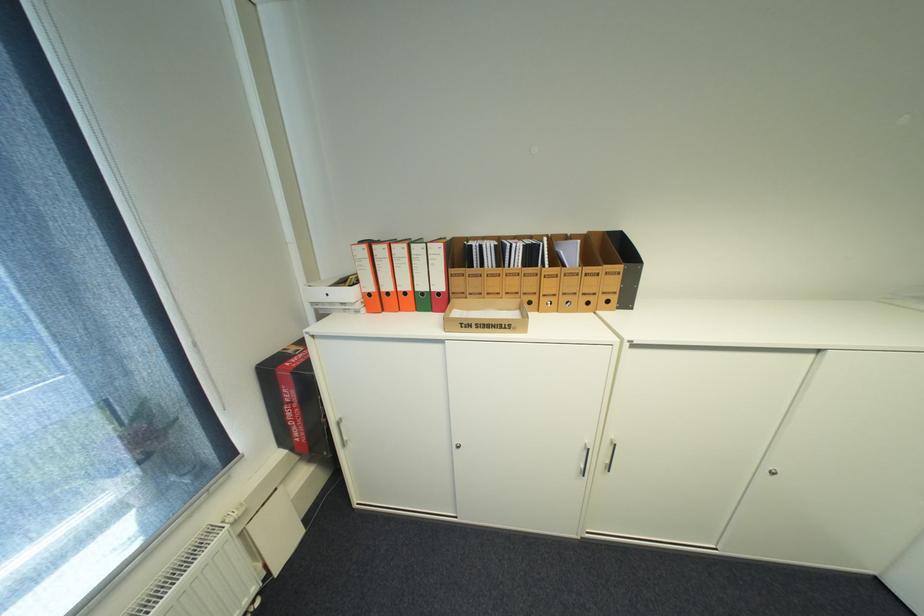
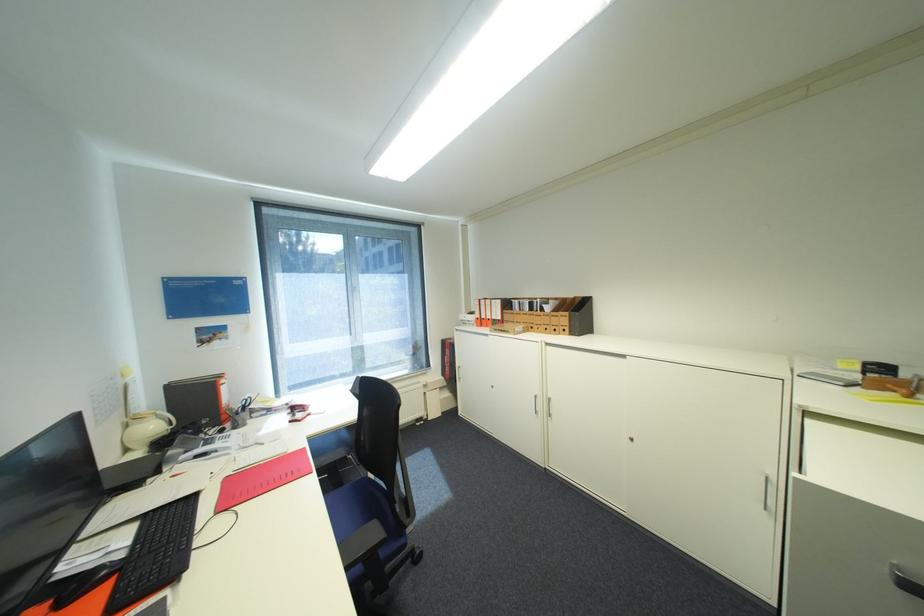
The point at (623, 446) is marked in the first image. Where is the corresponding point in the second image?

(556, 400)